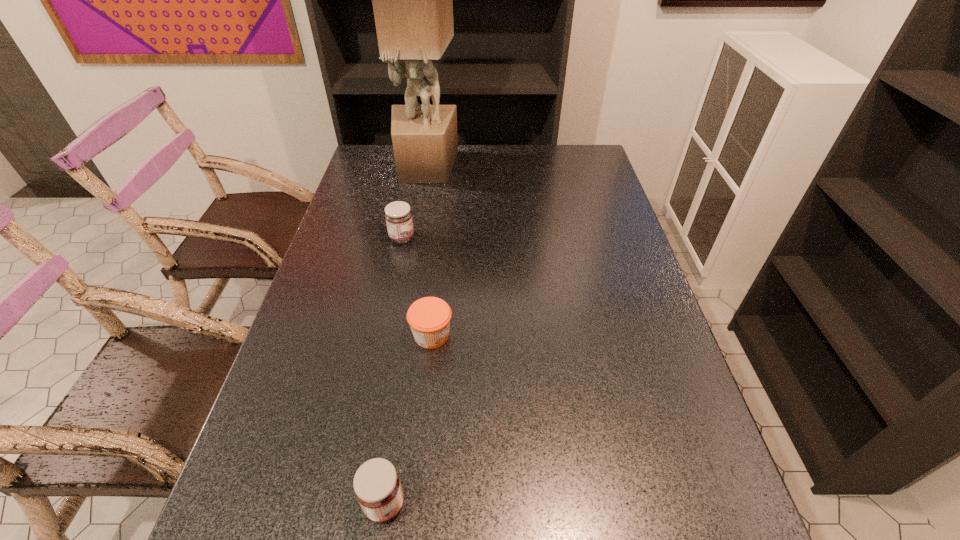
This screenshot has height=540, width=960. I want to click on jam object that ranks as the closest to the tallest object, so click(x=398, y=216).

The width and height of the screenshot is (960, 540). What are the coordinates of `free point that satisfies the following two spatial constraints: 1. on the front label of the shortest object; 2. on the front side of the nearest jam` in the screenshot? It's located at (415, 503).

Where is `free space that satisfies the following two spatial constraints: 1. on the front label of the shortest jam; 2. on the front side of the nearest jam`? The image size is (960, 540). free space that satisfies the following two spatial constraints: 1. on the front label of the shortest jam; 2. on the front side of the nearest jam is located at coordinates (415, 503).

Where is `vacant space that satisfies the following two spatial constraints: 1. on the front-facing side of the sculpture; 2. on the front label of the third nearest object`? The height and width of the screenshot is (540, 960). vacant space that satisfies the following two spatial constraints: 1. on the front-facing side of the sculpture; 2. on the front label of the third nearest object is located at coordinates (413, 238).

This screenshot has width=960, height=540. I want to click on free space that satisfies the following two spatial constraints: 1. on the front-facing side of the farthest object; 2. on the front label of the second farthest object, so click(x=413, y=238).